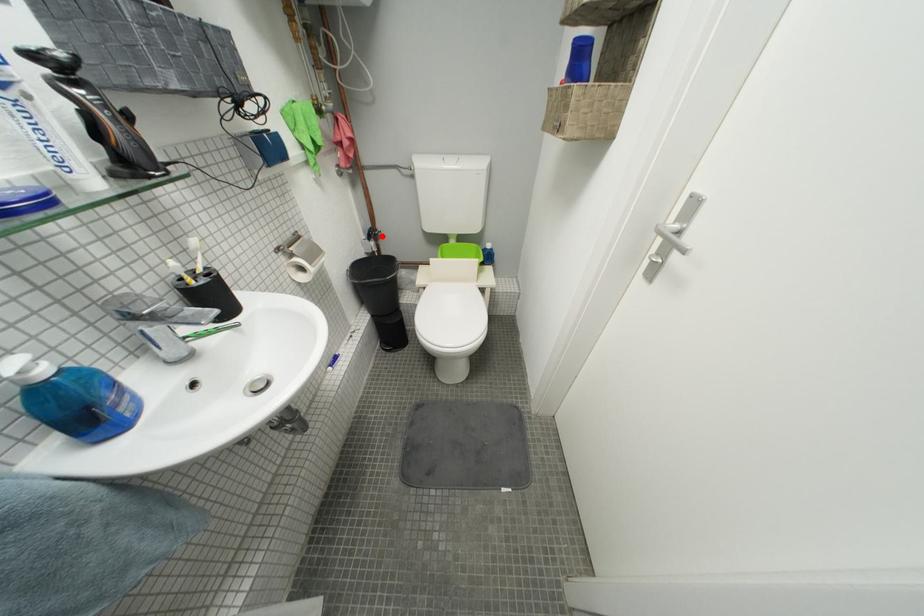
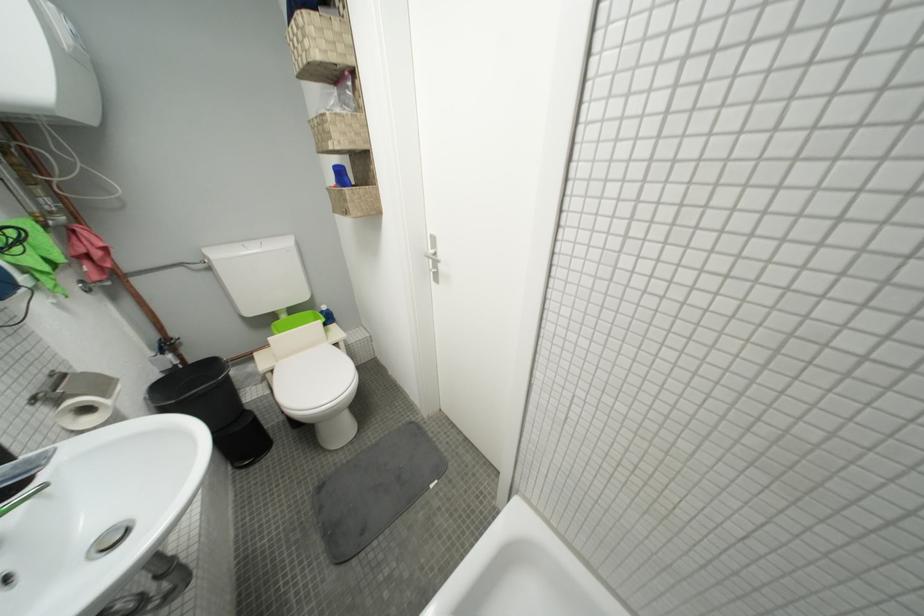
Question: I am providing you with two images of the same scene from different viewpoints. A red point is marked on the first image. Is the red point's position out of view in image 2?

Choices:
 (A) Yes
 (B) No

Answer: (B)